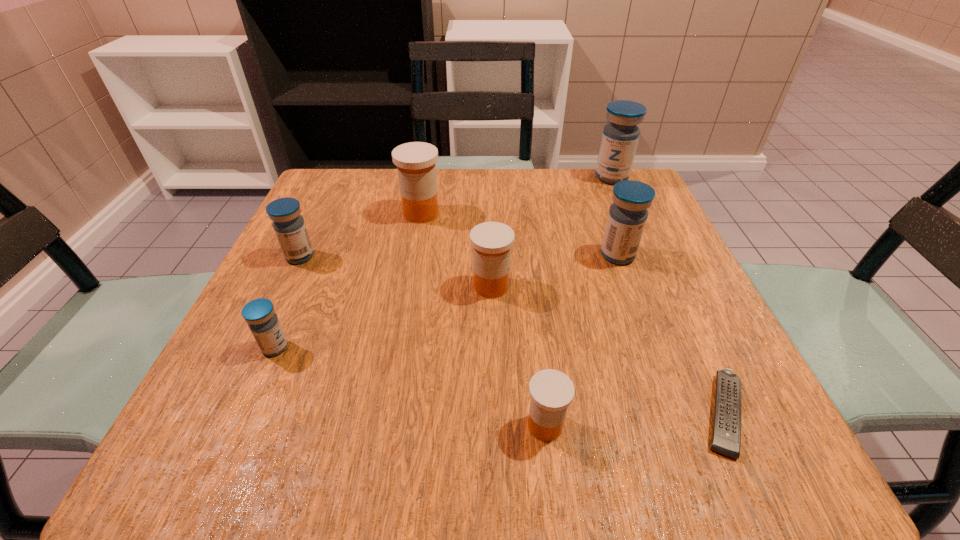
At what (x,y) coordinates should I click in order to perform the action: click on vacant space at the far edge. Please return your answer as a coordinate pair (x, y). Looking at the image, I should click on (499, 206).

The image size is (960, 540). Identify the location of vacant area at the near edge. (503, 436).

Locate an element on the screen. The height and width of the screenshot is (540, 960). vacant region at the left edge of the desktop is located at coordinates (315, 287).

Locate an element on the screen. vacant space at the right edge of the desktop is located at coordinates (671, 262).

In the image, there is a desktop. At what (x,y) coordinates should I click in order to perform the action: click on free space at the far left corner. Please return your answer as a coordinate pair (x, y). Looking at the image, I should click on (342, 176).

Locate an element on the screen. free space at the far right corner is located at coordinates (586, 198).

The image size is (960, 540). I want to click on vacant space at the near right corner of the desktop, so click(709, 427).

I want to click on empty location between the second biggest blue medicine and the fifth object from left to right, so click(582, 340).

Image resolution: width=960 pixels, height=540 pixels. I want to click on free space between the shortest object and the biggest blue medicine, so click(667, 295).

At what (x,y) coordinates should I click in order to perform the action: click on free spot between the fifth object from right to left and the farthest object. Please return your answer as a coordinate pair (x, y). Looking at the image, I should click on (551, 232).